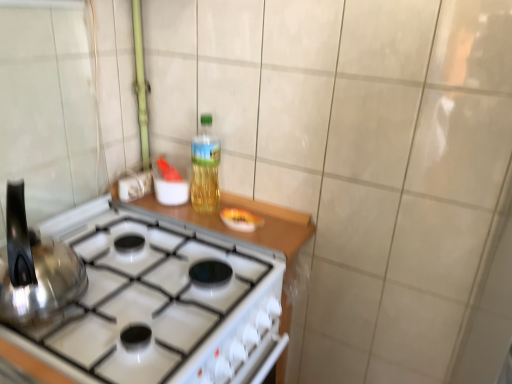
Locate an element on the screen. The height and width of the screenshot is (384, 512). blank space to the left of translucent plastic bottle at center is located at coordinates (163, 208).